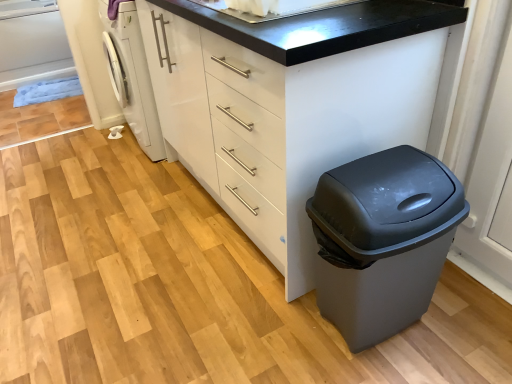
The image size is (512, 384). What are the coordinates of `vacant region to the right of matte gray plastic trash can at lower right` in the screenshot? It's located at (466, 326).